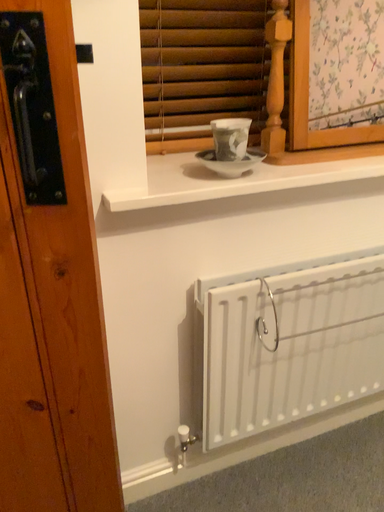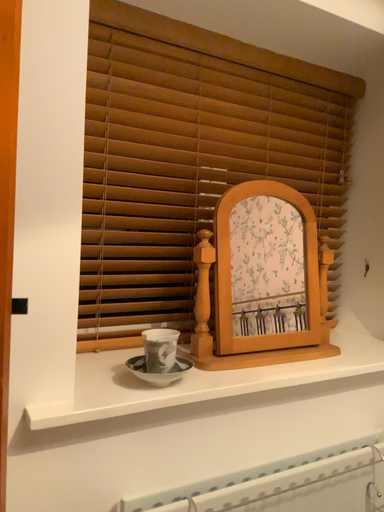
Question: How did the camera likely rotate when shooting the video?

Choices:
 (A) rotated downward
 (B) rotated upward

Answer: (B)